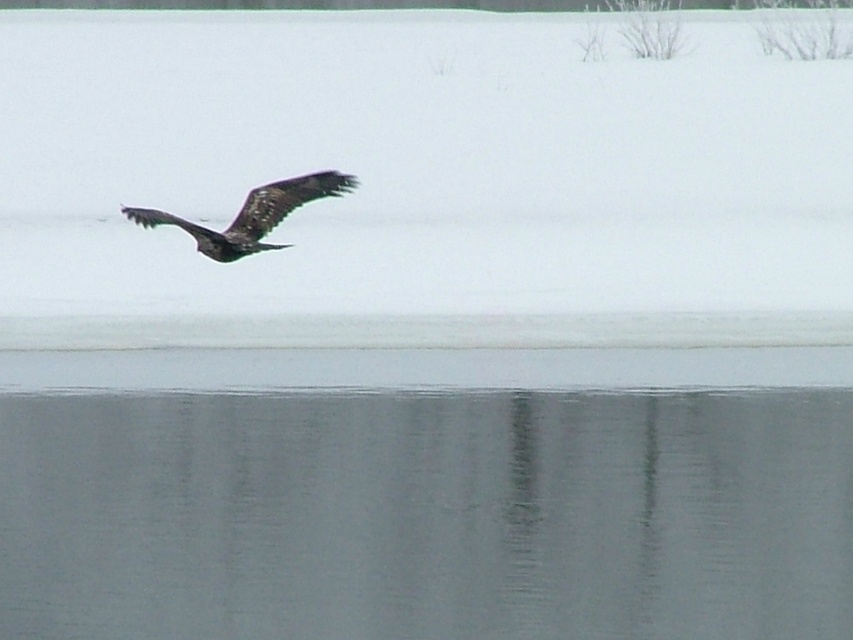
Based on the photo, you are a photographer aiming to capture the white fluffy snow at upper center and the smooth gray water at lower center in a single shot. Which object will appear closer to the camera in the photo?

The white fluffy snow at upper center appears closer to the camera because it is in front of the smooth gray water at lower center.